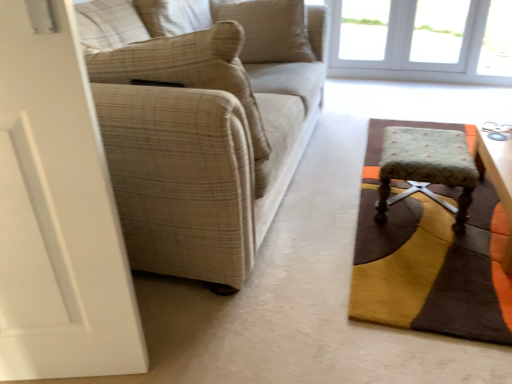
Where is `vacant space in front of floral fabric stool at lower right`? The image size is (512, 384). vacant space in front of floral fabric stool at lower right is located at coordinates [x=428, y=251].